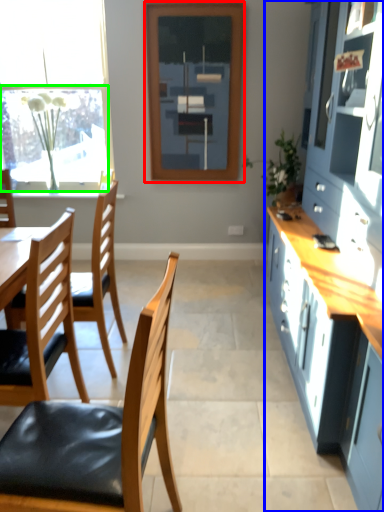
Question: Estimate the real-world distances between objects in this image. Which object is closer to window frame (highlighted by a red box), cabinetry (highlighted by a blue box) or window screen (highlighted by a green box)?

Choices:
 (A) cabinetry
 (B) window screen

Answer: (B)